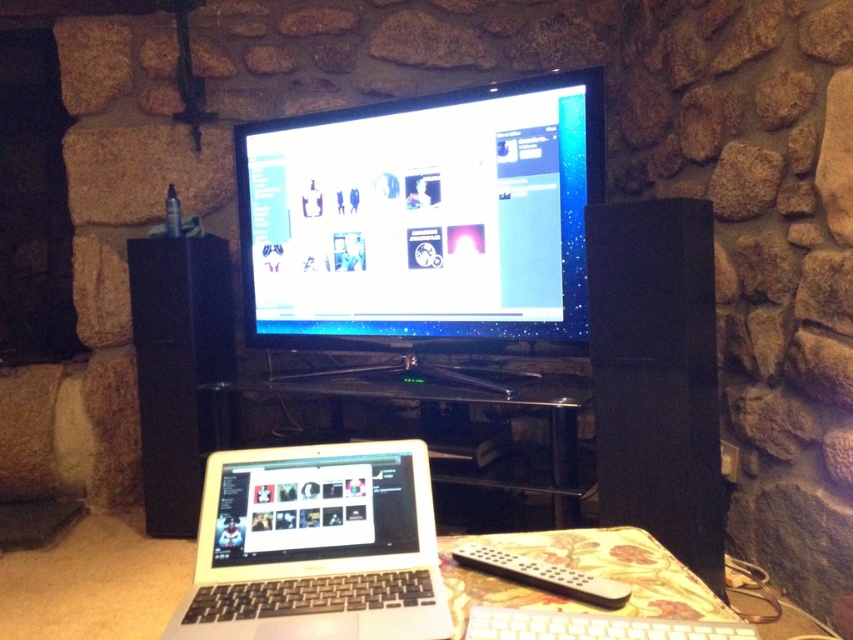
You are a delivery person who needs to place a large box that is 1.9 meters long on the floor in front of the black glass entertainment center at center. Considering the space between you and the entertainment center, can you fit the box without it overlapping the entertainment center?

The distance between the black glass entertainment center at center and the viewer is 1.87 meters, which is slightly shorter than the box length of 1.9 meters. Therefore, the box cannot be placed without overlapping the entertainment center.